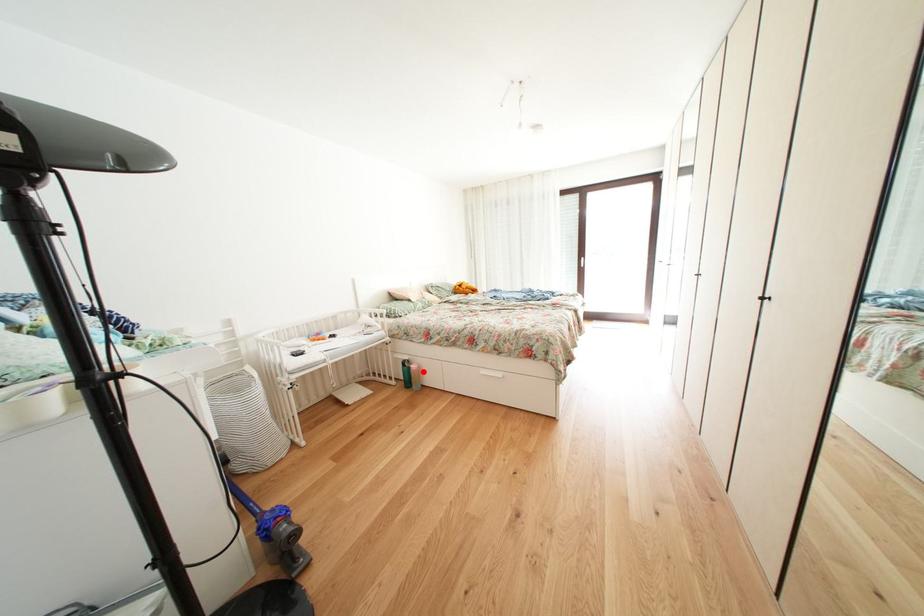
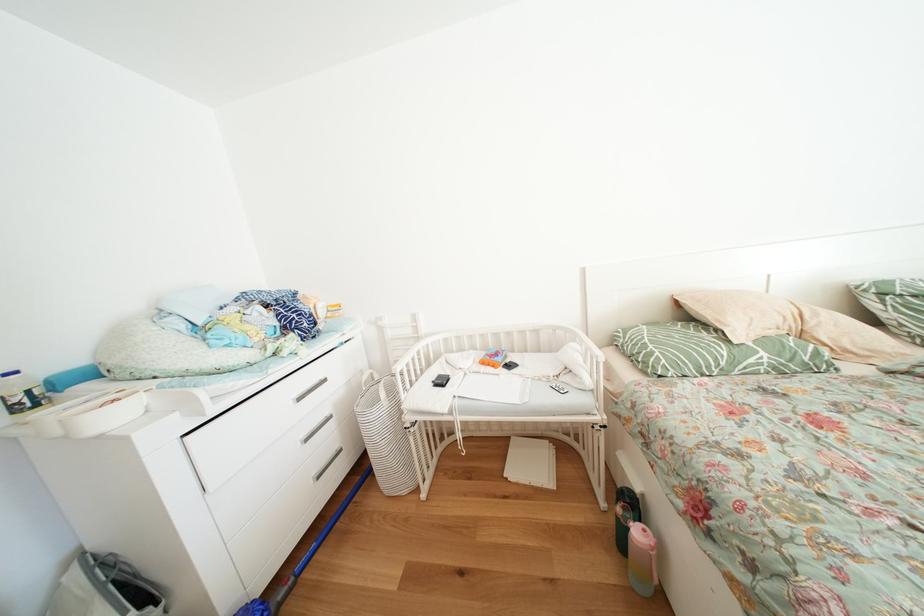
Locate, in the second image, the point that corresponds to the highlighted location in the first image.

(648, 538)